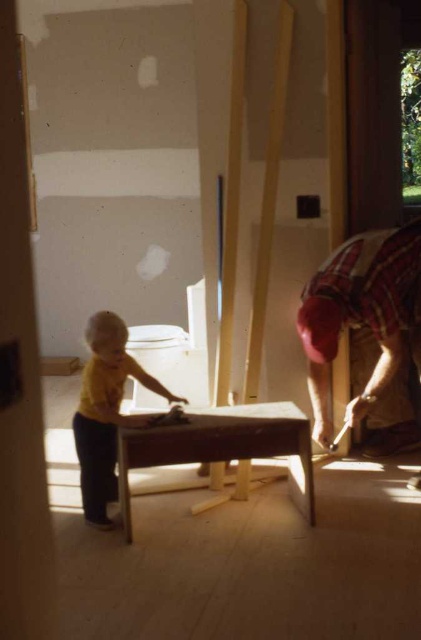
Looking at this image, you are a contractor working in this room and need to place a large tool box between the two points marked as point (381, 337) and point (135, 419). Which point should the box be closer to in order to be nearer to the unfinished wall?

The toolbox should be closer to point (381, 337) because it is closer to the unfinished wall since it is further to the viewer compared to point (135, 419).

You are a parent in the room and want to ensure the child is safe. Given the smooth wooden table at center and the yellow matte shirt at center, which object is more likely to be within the child reach?

The smooth wooden table at center has a smaller size compared to the yellow matte shirt at center, so the table is more likely to be within the child reach.

You are a construction worker in a room with unfinished walls and a large window on the right. You see a small wooden table in the foreground and a point marked at coordinates (364, 314). What object is located at that point?

The point at coordinates (364, 314) indicates the plaid fabric shirt at right.